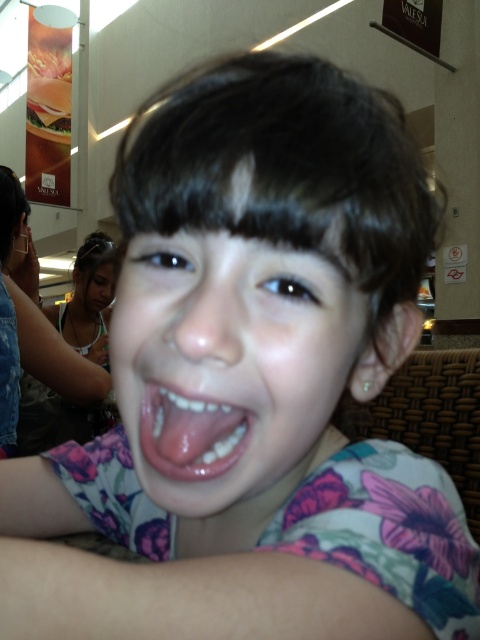
You are a photographer trying to capture the pink glossy tongue at center and the yellow cheeseburger at upper left in the same frame. Which object should you focus on first if you want to ensure both are in focus? Please explain your reasoning based on their sizes and positions.

The pink glossy tongue at center should be focused on first because it is smaller in size compared to the yellow cheeseburger at upper left. Smaller objects require a narrower depth of field to keep them in focus, so starting with the smaller pink glossy tongue at center ensures both objects can be captured clearly.